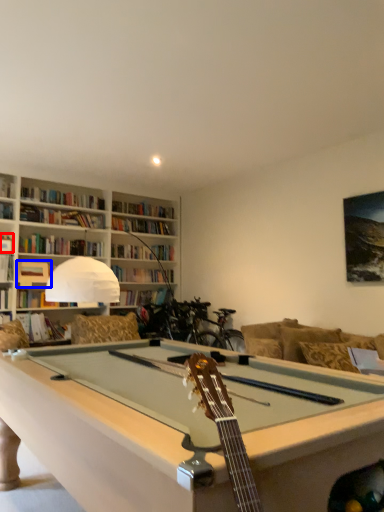
Question: Which of the following is the closest to the observer, book (highlighted by a red box) or book (highlighted by a blue box)?

Choices:
 (A) book
 (B) book

Answer: (A)